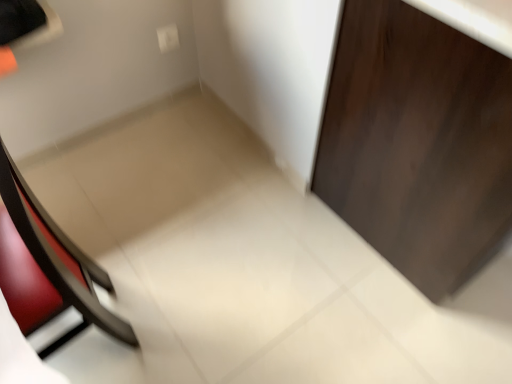
The height and width of the screenshot is (384, 512). I want to click on vacant space underneath matte black chair at left (from a real-world perspective), so (79, 348).